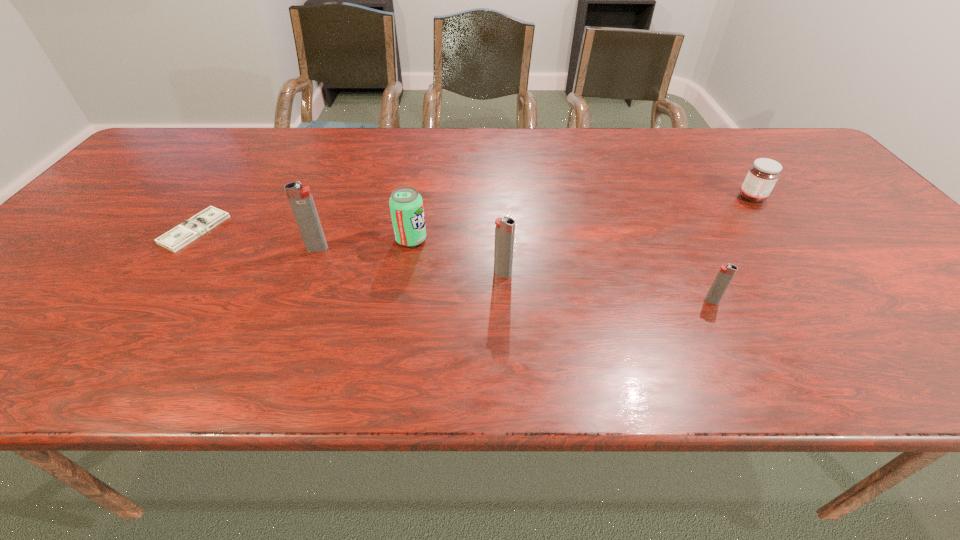
The image size is (960, 540). What are the coordinates of `pop soda` in the screenshot? It's located at (406, 205).

Find the location of `the fourth shortest object`. the fourth shortest object is located at coordinates (406, 205).

The width and height of the screenshot is (960, 540). Identify the location of free space located on the left of the fifth object from right to left. (268, 248).

Where is `free location located on the right of the second igniter from left to right`? The height and width of the screenshot is (540, 960). free location located on the right of the second igniter from left to right is located at coordinates (585, 273).

I want to click on free space located 0.290m on the right of the shortest igniter, so click(859, 301).

At what (x,y) coordinates should I click in order to perform the action: click on vacant space located 0.220m on the right of the farthest object. Please return your answer as a coordinate pair (x, y). This screenshot has height=540, width=960. Looking at the image, I should click on (849, 197).

Locate an element on the screen. The height and width of the screenshot is (540, 960). vacant space situated 0.310m on the right of the leftmost object is located at coordinates (349, 230).

At what (x,y) coordinates should I click in order to perform the action: click on free space located 0.380m on the front-facing side of the pop soda. Please return your answer as a coordinate pair (x, y). Looking at the image, I should click on (588, 239).

Find the location of a particular element. object at the near edge is located at coordinates click(x=725, y=274).

The image size is (960, 540). I want to click on vacant space at the far edge of the desktop, so click(264, 162).